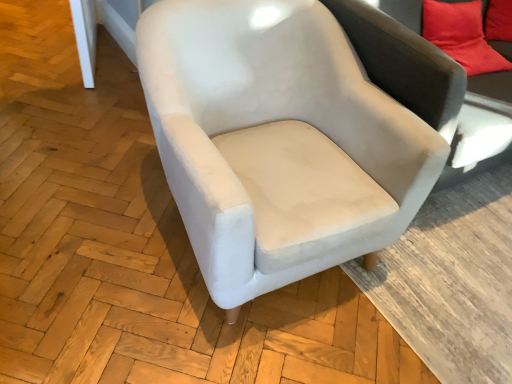
Locate an element on the screen. The width and height of the screenshot is (512, 384). free space to the left of suede-like beige armchair at center is located at coordinates (84, 189).